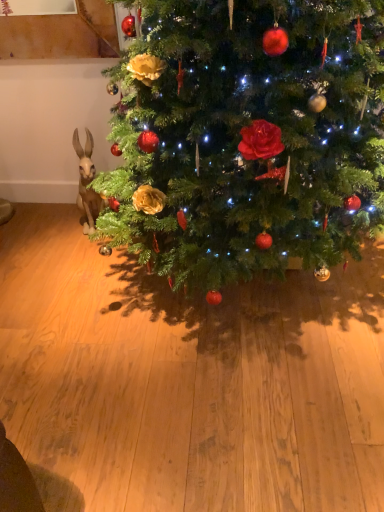
Question: Is green matte christmas tree at center taller or shorter than matte plastic rabbit at left?

Choices:
 (A) tall
 (B) short

Answer: (A)

Question: Choose the correct answer: Is green matte christmas tree at center inside matte plastic rabbit at left or outside it?

Choices:
 (A) inside
 (B) outside

Answer: (B)

Question: In the image, is green matte christmas tree at center on the left side or the right side of matte plastic rabbit at left?

Choices:
 (A) right
 (B) left

Answer: (A)

Question: From a real-world perspective, is matte plastic rabbit at left above or below green matte christmas tree at center?

Choices:
 (A) above
 (B) below

Answer: (B)

Question: Is point (87, 206) positioned closer to the camera than point (190, 211)?

Choices:
 (A) farther
 (B) closer

Answer: (A)

Question: From the image's perspective, is matte plastic rabbit at left above or below green matte christmas tree at center?

Choices:
 (A) above
 (B) below

Answer: (B)

Question: In terms of height, does matte plastic rabbit at left look taller or shorter compared to green matte christmas tree at center?

Choices:
 (A) tall
 (B) short

Answer: (B)